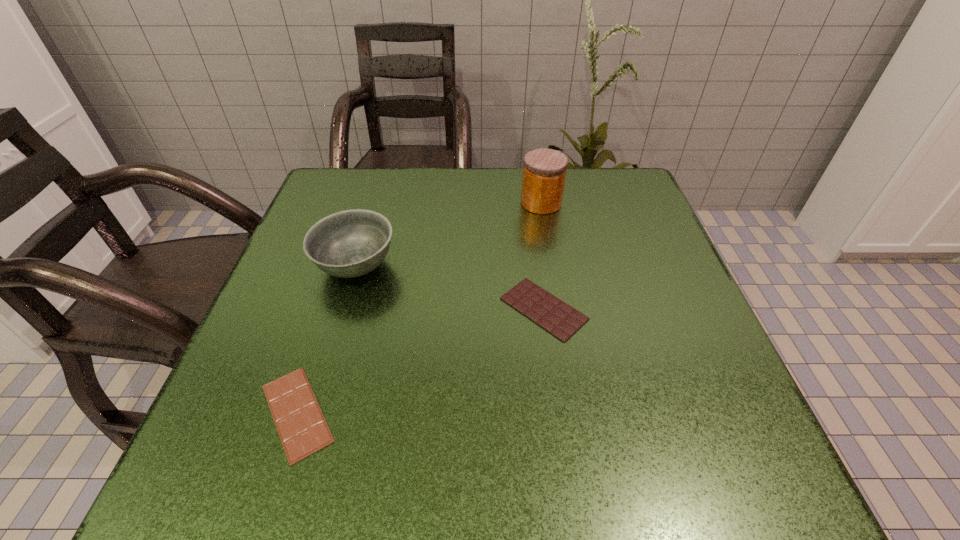
At what (x,y) coordinates should I click in order to perform the action: click on object at the far edge. Please return your answer as a coordinate pair (x, y). Looking at the image, I should click on (544, 172).

Where is `object that is at the near edge`? The image size is (960, 540). object that is at the near edge is located at coordinates (302, 428).

This screenshot has height=540, width=960. I want to click on bowl positioned at the left edge, so click(351, 243).

The image size is (960, 540). I want to click on chocolate bar located in the left edge section of the desktop, so click(302, 428).

Locate an element on the screen. object that is at the near left corner is located at coordinates (302, 428).

Where is `free space at the far edge of the desktop`? The height and width of the screenshot is (540, 960). free space at the far edge of the desktop is located at coordinates (476, 203).

Find the location of a particular element. This screenshot has width=960, height=540. free space at the near edge is located at coordinates 570,494.

Find the location of a particular element. This screenshot has width=960, height=540. vacant space at the left edge of the desktop is located at coordinates (299, 281).

In the image, there is a desktop. Where is `vacant region at the right edge`? This screenshot has width=960, height=540. vacant region at the right edge is located at coordinates (649, 310).

This screenshot has width=960, height=540. Find the location of `vacant space at the far left corner of the desktop`. vacant space at the far left corner of the desktop is located at coordinates (382, 171).